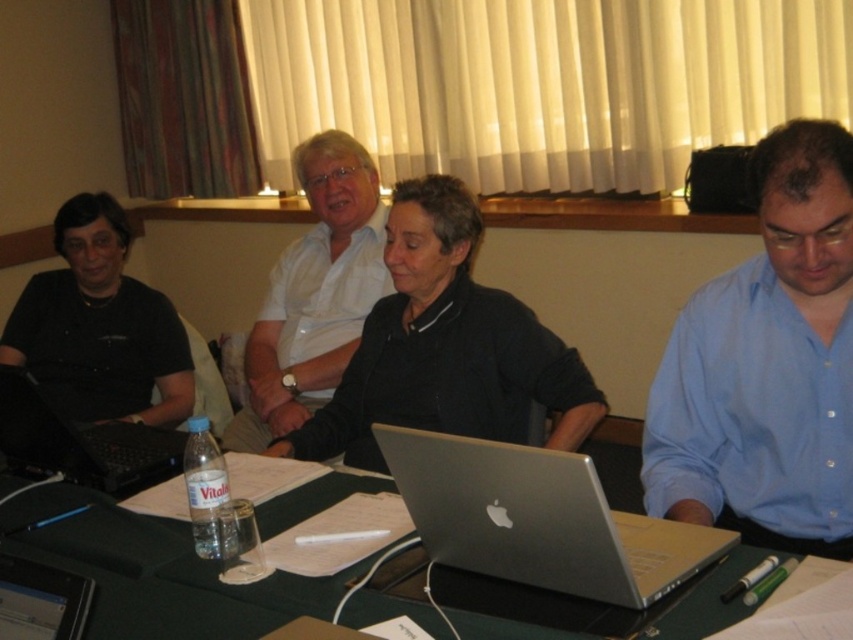
Question: Can you confirm if green matte table at center is thinner than white glossy shirt at center?

Choices:
 (A) yes
 (B) no

Answer: (B)

Question: Can you confirm if black matte laptop at left is wider than silver metallic tablet at lower left?

Choices:
 (A) no
 (B) yes

Answer: (B)

Question: Which of the following is the farthest from the observer?

Choices:
 (A) matte black laptop at left
 (B) silver metallic laptop at center

Answer: (A)

Question: Does green matte table at center have a smaller size compared to white matte shirt at center?

Choices:
 (A) no
 (B) yes

Answer: (B)

Question: Estimate the real-world distances between objects in this image. Which object is closer to the matte black laptop at left?

Choices:
 (A) white matte shirt at center
 (B) silver metallic tablet at lower left
 (C) green matte table at center
 (D) silver metallic laptop at center

Answer: (A)

Question: Which point appears closest to the camera in this image?

Choices:
 (A) (566, 548)
 (B) (497, 307)
 (C) (119, 456)
 (D) (160, 636)

Answer: (A)